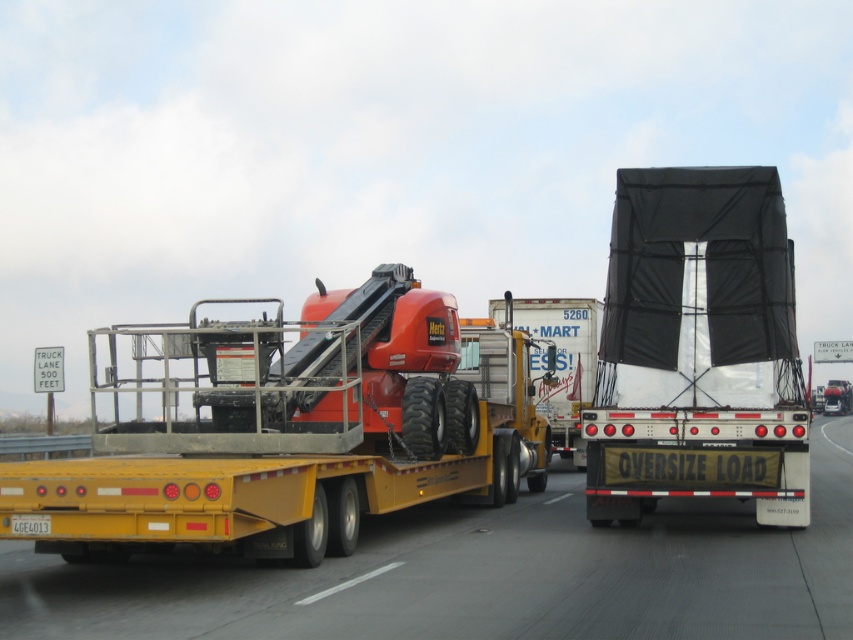
You are a traffic officer observing a highway scene. You see a yellow flatbed trailer carrying construction equipment and a white semi truck with an oversized load. There is a point at coordinates (698,348). Which vehicle is this point located on?

The point at (698,348) corresponds to the black mesh truck at center.